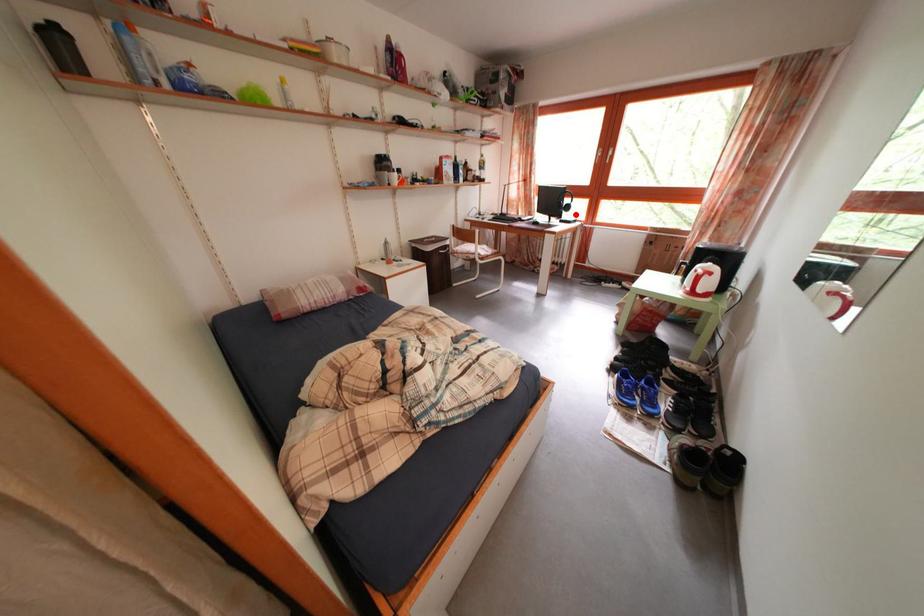
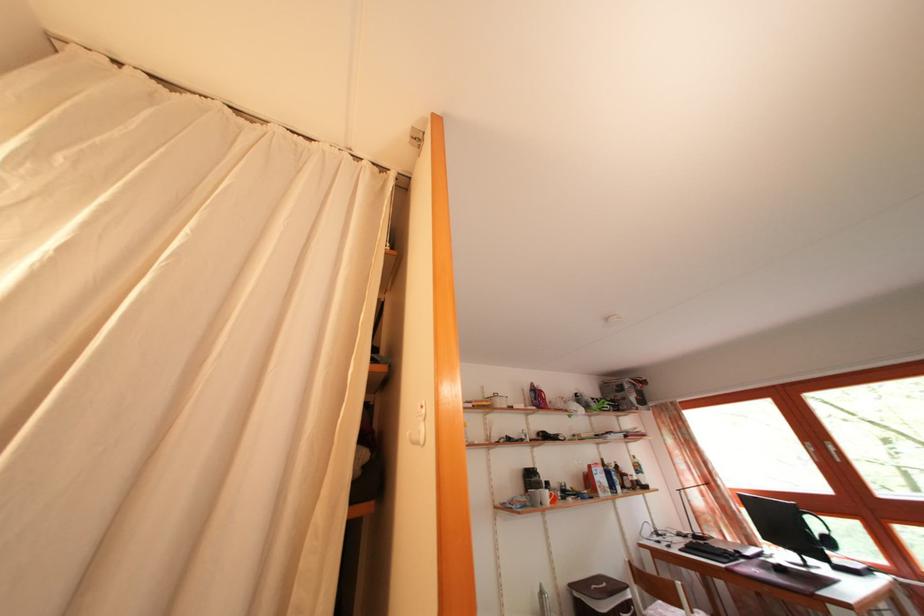
Question: I am providing you with two images of the same scene from different viewpoints. In image1, a red point is highlighted. Considering the same 3D point in image2, which of the following is correct?

Choices:
 (A) It is closer
 (B) It is farther

Answer: (A)